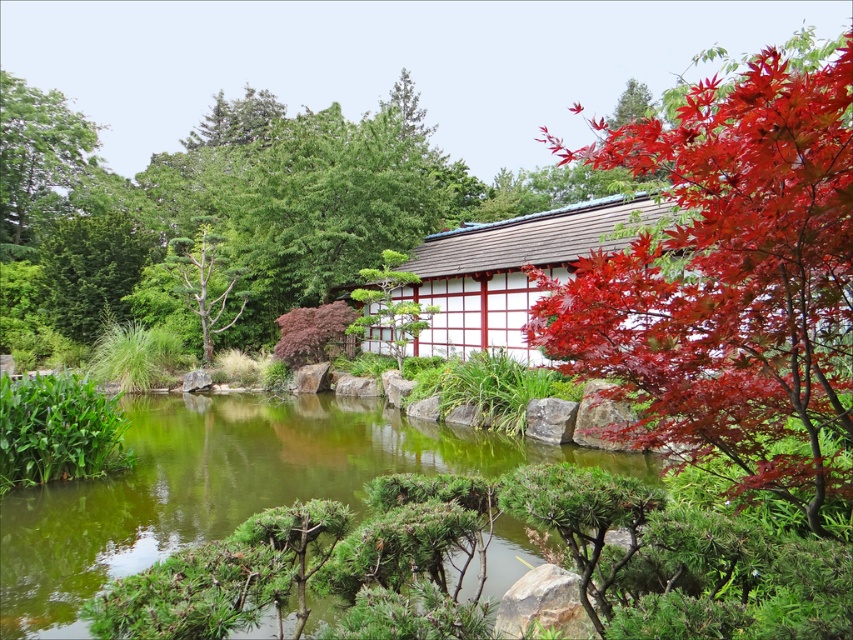
Where is `bare wood tree at center-left`? The image size is (853, 640). bare wood tree at center-left is located at coordinates (206, 284).

Consider the image. Who is more distant from viewer, [192,266] or [367,310]?

The point [192,266] is more distant.

The height and width of the screenshot is (640, 853). Identify the location of bare wood tree at center-left. (206, 284).

Is green leafy tree at center behind bare wood tree at center-left?

No.

Does point (215, 170) come farther from viewer compared to point (165, 269)?

Yes, it is.

Does point (320, 115) come in front of point (209, 326)?

No, it is not.

At what (x,y) coordinates should I click in order to perform the action: click on green leafy tree at center. Please return your answer as a coordinate pair (x, y). The height and width of the screenshot is (640, 853). Looking at the image, I should click on (219, 216).

Does green leafy tree at center appear over green matte tree at center?

Yes, green leafy tree at center is above green matte tree at center.

Is green leafy tree at center thinner than green matte tree at center?

No, green leafy tree at center is not thinner than green matte tree at center.

This screenshot has width=853, height=640. Find the location of `green leafy tree at center`. green leafy tree at center is located at coordinates (219, 216).